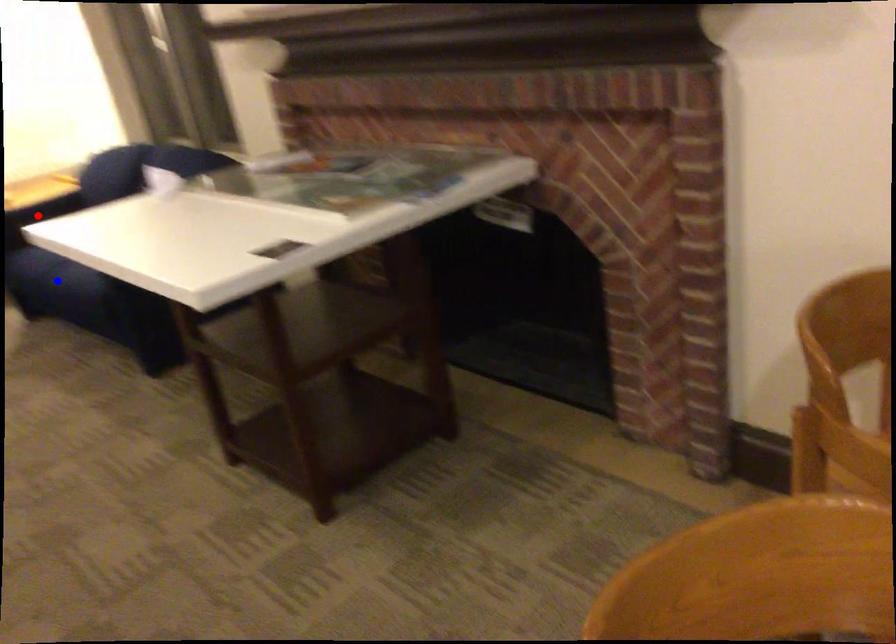
Question: In the image, two points are highlighted. Which point is nearer to the camera? Reply with the corresponding letter.

Choices:
 (A) blue point
 (B) red point

Answer: (A)